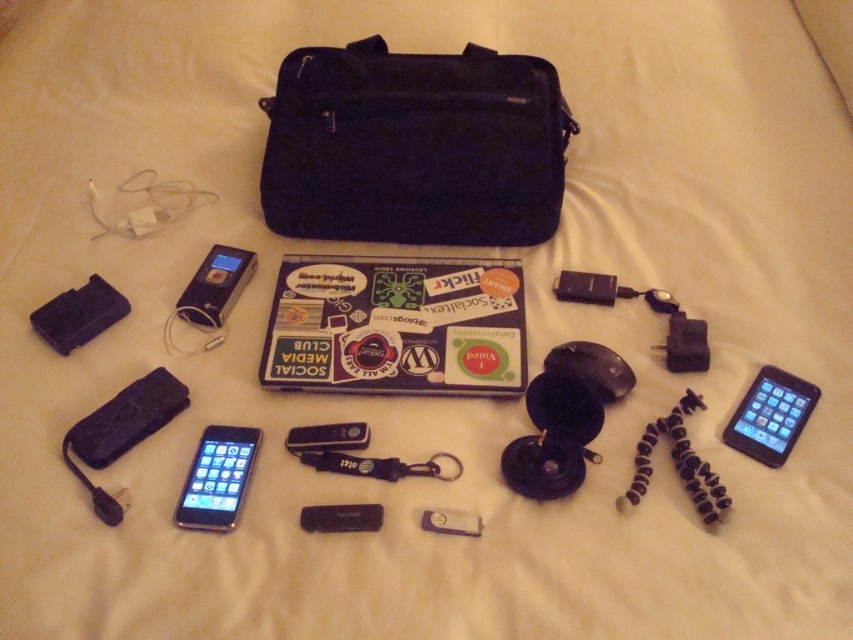
You are holding a 1.5 meter long cable and need to connect two devices placed on the light fabric surface. The devices are the dark blue fabric bag at center and the small rectangular device on the left side. Can the cable reach both devices if they are 1.20 meters apart?

The devices are 1.20 meters apart, and the cable is 1.5 meters long, so yes, the cable can easily reach both devices.

You are packing for a trip and see the dark blue fabric bag at center and the black glossy ipod at lower left. Which item is covering the other one?

The dark blue fabric bag at center is positioned over the black glossy ipod at lower left, so it is covering it.